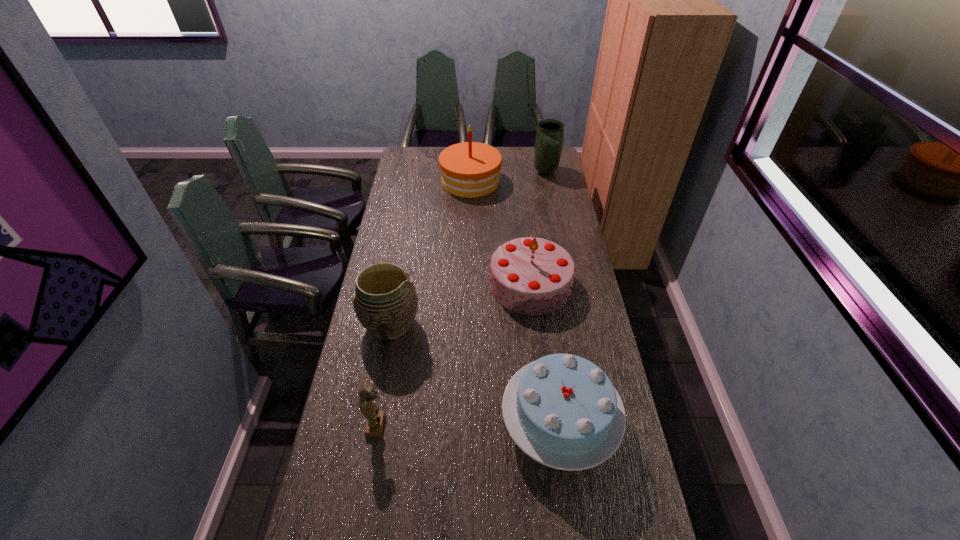
Locate an element on the screen. Image resolution: width=960 pixels, height=540 pixels. free region at the right edge of the desktop is located at coordinates (550, 198).

In order to click on free spot between the second nearest birthday cake and the pottery in this screenshot , I will do `click(461, 304)`.

Image resolution: width=960 pixels, height=540 pixels. Identify the location of blank region between the nearest birthday cake and the second nearest birthday cake. (545, 354).

The width and height of the screenshot is (960, 540). Find the location of `unoccupied area between the nearest birthday cake and the second nearest birthday cake`. unoccupied area between the nearest birthday cake and the second nearest birthday cake is located at coordinates (545, 354).

Locate an element on the screen. The height and width of the screenshot is (540, 960). vacant area that lies between the farthest birthday cake and the vase is located at coordinates (508, 177).

The height and width of the screenshot is (540, 960). Identify the location of blank region between the nearest birthday cake and the pottery. (475, 374).

This screenshot has width=960, height=540. In order to click on vacant space in between the pottery and the nearest birthday cake in this screenshot , I will do click(x=475, y=374).

This screenshot has width=960, height=540. What are the coordinates of `vacant space that is in between the pottery and the second farthest birthday cake` in the screenshot? It's located at (461, 304).

Locate an element on the screen. This screenshot has height=540, width=960. vacant area that lies between the figurine and the second nearest birthday cake is located at coordinates (454, 355).

Where is `vacant area that lies between the figurine and the second nearest birthday cake`? vacant area that lies between the figurine and the second nearest birthday cake is located at coordinates (454, 355).